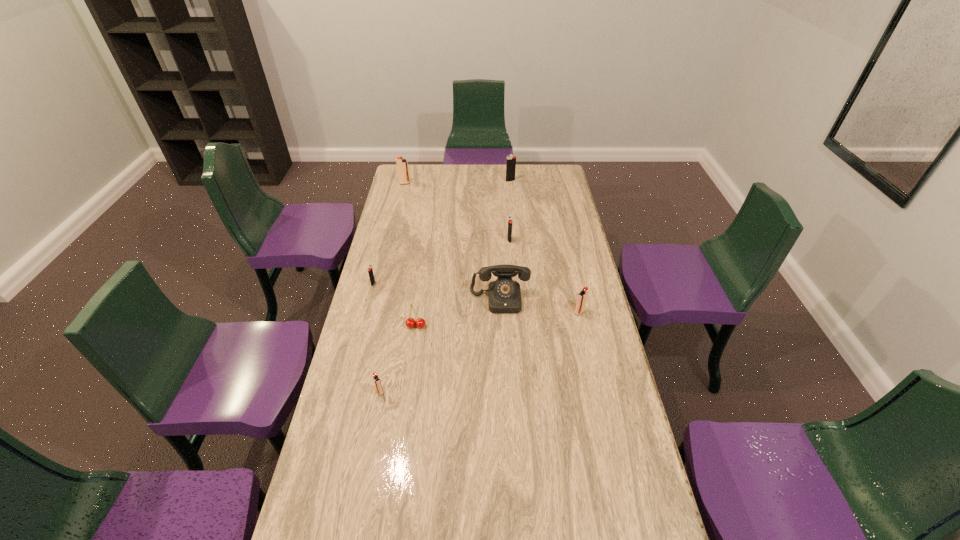
Where is `the biggest red igniter`? This screenshot has height=540, width=960. the biggest red igniter is located at coordinates (402, 164).

Image resolution: width=960 pixels, height=540 pixels. I want to click on the farthest red igniter, so click(402, 164).

Where is `the farthest black igniter`? the farthest black igniter is located at coordinates (511, 160).

Find the location of a particular element. Image resolution: width=960 pixels, height=540 pixels. telephone is located at coordinates (504, 295).

This screenshot has height=540, width=960. Identify the location of the sixth nearest object. (509, 235).

Where is `the third farthest igniter`? the third farthest igniter is located at coordinates (509, 235).

The height and width of the screenshot is (540, 960). Identify the location of the rightmost object. (582, 296).

I want to click on the second smallest red igniter, so click(582, 296).

The width and height of the screenshot is (960, 540). I want to click on cherry, so click(x=410, y=322).

The width and height of the screenshot is (960, 540). Find the location of `the fourth object from left to right`. the fourth object from left to right is located at coordinates (410, 322).